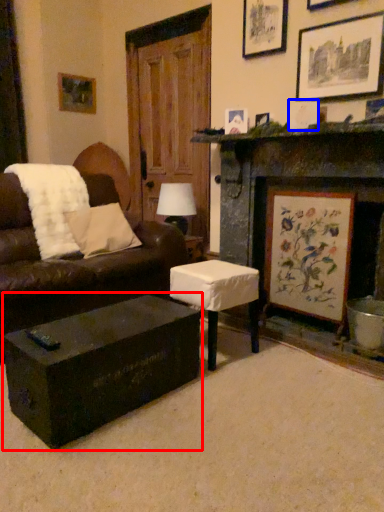
Question: Which object appears closest to the camera in this image, coffee table (highlighted by a red box) or picture frame (highlighted by a blue box)?

Choices:
 (A) coffee table
 (B) picture frame

Answer: (A)